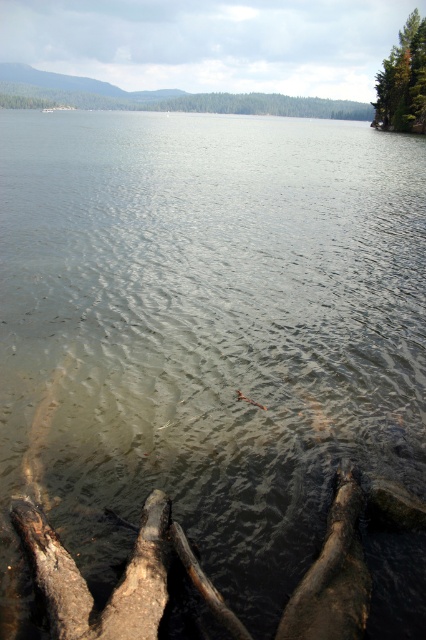
You are a painter setting up your easel to capture the lakeside scene. You want to include both the dark brown rough wood at lower left and the dark brown wood log at lower center in your painting. Which object should you place first to ensure proper perspective, considering their sizes and positions?

Since the dark brown rough wood at lower left is larger in size than the dark brown wood log at lower center, you should place the dark brown rough wood at lower left first to establish the foreground element before adding the smaller log in the lower center for depth and perspective.

You are standing at the lakeside and see a point marked at coordinates (333,576). Based on the scene description, what object is located at that point?

The point at coordinates (333,576) corresponds to the dark brown wood log at lower center.

You are standing on the lakeside path and see the dark brown rough wood at lower left and the dark brown wood log at lower center. Which object is positioned closer to your left side?

The dark brown rough wood at lower left is positioned to the left of the dark brown wood log at lower center, so it is closer to your left side.